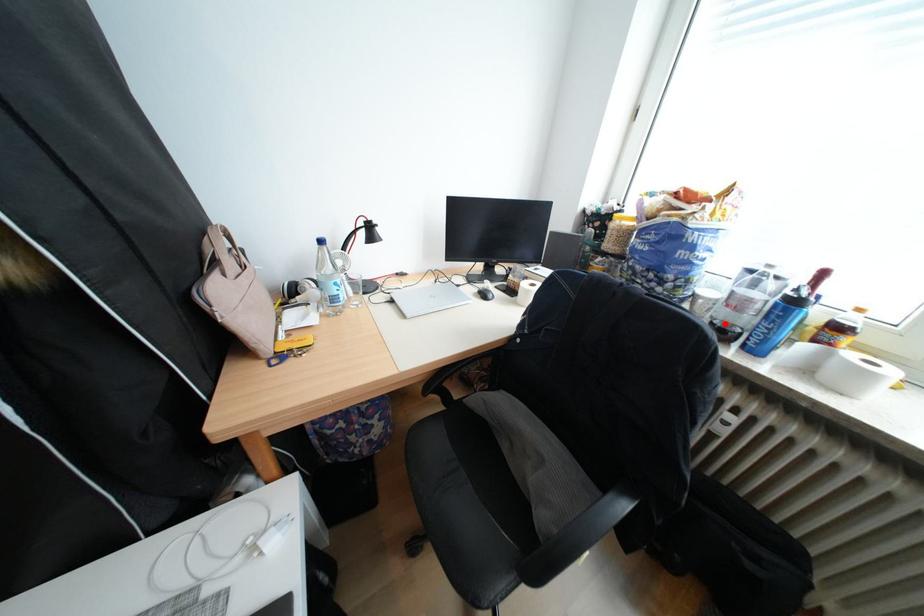
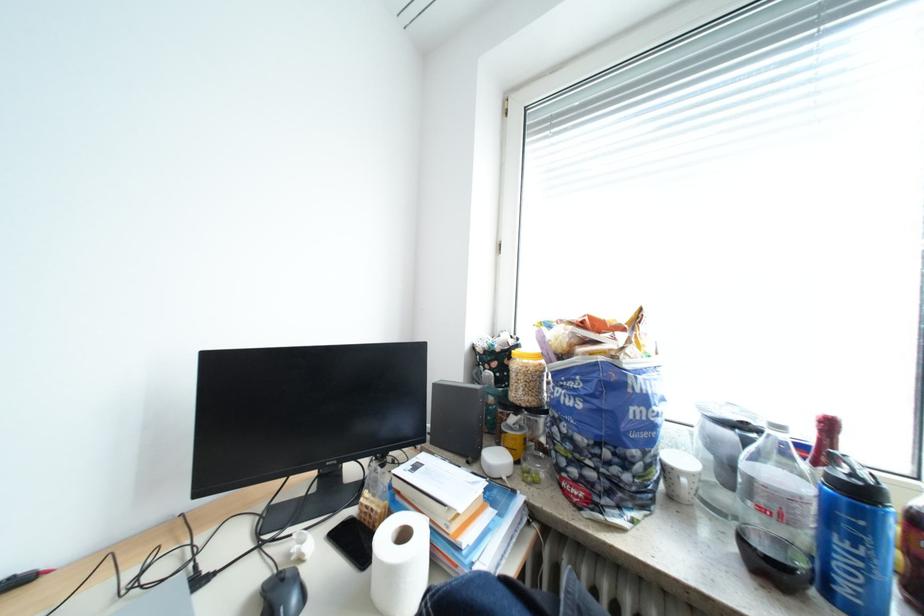
Locate, in the second image, the point that corresponds to the highlighted location in the first image.

(756, 541)